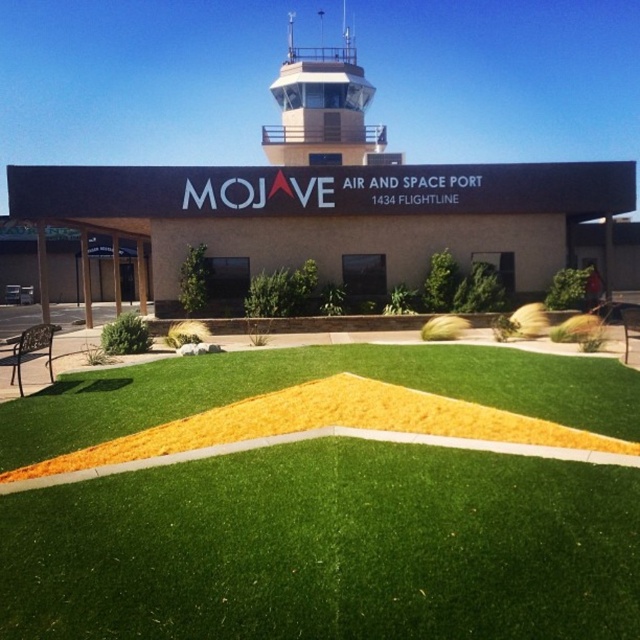
Question: Can you confirm if green artificial grass at center is thinner than matte gray control tower at upper center?

Choices:
 (A) no
 (B) yes

Answer: (B)

Question: Which object appears farthest from the camera in this image?

Choices:
 (A) matte gray control tower at upper center
 (B) green artificial grass at center

Answer: (A)

Question: Which point is farther from the camera taking this photo?

Choices:
 (A) (296, 100)
 (B) (586, 424)

Answer: (A)

Question: Observing the image, what is the correct spatial positioning of green artificial grass at center in reference to matte gray control tower at upper center?

Choices:
 (A) left
 (B) right

Answer: (B)

Question: Does green artificial grass at center have a greater width compared to matte gray control tower at upper center?

Choices:
 (A) no
 (B) yes

Answer: (A)